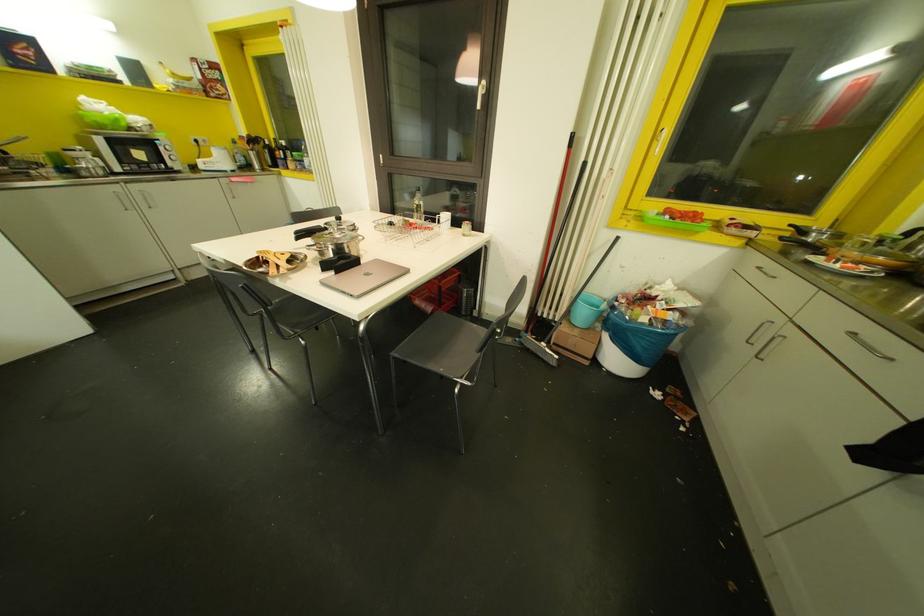
At what (x,y) coordinates should I click in order to perform the action: click on blue bucket. Please return your answer as a coordinate pair (x, y). Looking at the image, I should click on (630, 344).